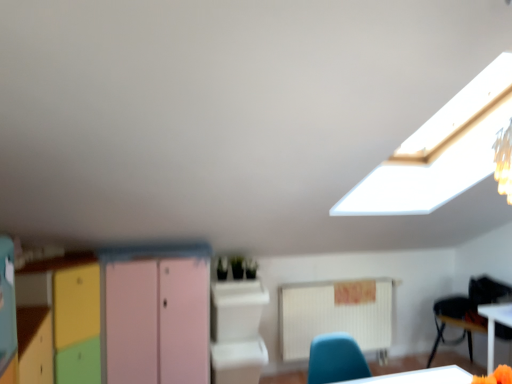
Describe the element at coordinates (237, 331) in the screenshot. I see `white glossy computer desk at center` at that location.

Image resolution: width=512 pixels, height=384 pixels. Describe the element at coordinates (137, 311) in the screenshot. I see `pastel wood cabinet at center` at that location.

Locate an element on the screen. The image size is (512, 384). white plastic chair at lower right is located at coordinates (467, 311).

This screenshot has width=512, height=384. Find the location of `white glossy computer desk at center`. white glossy computer desk at center is located at coordinates (237, 331).

From a real-world perspective, which is physically below, white glossy computer desk at center or white glossy table at lower right?

white glossy table at lower right, from a real-world perspective.

Considering the sizes of objects white glossy computer desk at center and white glossy table at lower right in the image provided, who is shorter, white glossy computer desk at center or white glossy table at lower right?

Standing shorter between the two is white glossy table at lower right.

What's the angular difference between white glossy computer desk at center and white glossy table at lower right's facing directions?

They differ by 89.3 degrees in their facing directions.

From a real-world perspective, is pastel wood cabinet at center over white glossy computer desk at center?

No, from a real-world perspective, pastel wood cabinet at center is not on top of white glossy computer desk at center.

Is pastel wood cabinet at center shorter than white glossy computer desk at center?

No.

Does point (112, 311) lie in front of point (251, 291)?

Yes, it is.

Which object is positioned more to the left, white glossy table at lower right or white glossy computer desk at center?

white glossy computer desk at center.

Considering the relative positions of white glossy table at lower right and white glossy computer desk at center in the image provided, is white glossy table at lower right behind white glossy computer desk at center?

Yes, white glossy table at lower right is further from the viewer.

From a real-world perspective, is white glossy table at lower right above or below white glossy computer desk at center?

Clearly, from a real-world perspective, white glossy table at lower right is below white glossy computer desk at center.

Is pastel wood cabinet at center at the back of white plastic chair at lower right?

white plastic chair at lower right does not have its back to pastel wood cabinet at center.

Between white plastic chair at lower right and pastel wood cabinet at center, which one is positioned behind?

white plastic chair at lower right.

Is white plastic chair at lower right with pastel wood cabinet at center?

There is a gap between white plastic chair at lower right and pastel wood cabinet at center.

Can you confirm if white plastic chair at lower right is smaller than pastel wood cabinet at center?

Yes.

From the image's perspective, does velvet black armchair at lower right appear lower than white plastic chair at lower right?

No, from the image's perspective, velvet black armchair at lower right is not beneath white plastic chair at lower right.

In order to click on armchair that appears above the white plastic chair at lower right (from the image's perspective) in this screenshot , I will do (452, 322).

Is velvet black armchair at lower right far from white plastic chair at lower right?

That's not correct — velvet black armchair at lower right is a little close to white plastic chair at lower right.

Is velvet black armchair at lower right looking in the opposite direction of white plastic chair at lower right?

Yes, velvet black armchair at lower right is positioned with its back facing white plastic chair at lower right.

Is point (498, 320) closer to viewer compared to point (126, 296)?

No, (498, 320) is further to viewer.

Considering the sizes of white glossy table at lower right and pastel wood cabinet at center in the image, is white glossy table at lower right bigger or smaller than pastel wood cabinet at center?

Considering their sizes, white glossy table at lower right takes up less space than pastel wood cabinet at center.

Is white glossy table at lower right oriented towards pastel wood cabinet at center?

Yes.

Does white glossy table at lower right have a greater height compared to pastel wood cabinet at center?

In fact, white glossy table at lower right may be shorter than pastel wood cabinet at center.

Is pink matte/file cabinet at center taller or shorter than pastel wood cabinet at center?

Considering their sizes, pink matte/file cabinet at center has more height than pastel wood cabinet at center.

Who is more distant, pink matte/file cabinet at center or pastel wood cabinet at center?

pink matte/file cabinet at center is further from the camera.

Which is in front, point (149, 260) or point (111, 307)?

The point (111, 307) is in front.

Where is `table top that is behind the white glossy computer desk at center`? table top that is behind the white glossy computer desk at center is located at coordinates (497, 313).

The width and height of the screenshot is (512, 384). I want to click on computer desk positioned vertically above the pastel wood cabinet at center (from a real-world perspective), so click(237, 331).

Which object lies nearer to the anchor point white plastic chair at lower right, white glossy table at lower right or pastel wood cabinet at center?

white glossy table at lower right lies closer to white plastic chair at lower right than the other object.

Considering their positions, is white plastic chair at lower right positioned further to white glossy table at lower right than white glossy computer desk at center?

Based on the image, white glossy computer desk at center appears to be further to white glossy table at lower right.

Estimate the real-world distances between objects in this image. Which object is further from pink matte/file cabinet at center, white glossy computer desk at center or velvet black armchair at lower right?

Based on the image, velvet black armchair at lower right appears to be further to pink matte/file cabinet at center.

Estimate the real-world distances between objects in this image. Which object is closer to white glossy computer desk at center, white plastic chair at lower right or velvet black armchair at lower right?

white plastic chair at lower right.

Estimate the real-world distances between objects in this image. Which object is closer to white glossy computer desk at center, white plastic chair at lower right or pink matte/file cabinet at center?

Based on the image, pink matte/file cabinet at center appears to be nearer to white glossy computer desk at center.

Looking at the image, which one is located further to velvet black armchair at lower right, white glossy table at lower right or pastel wood cabinet at center?

Among the two, pastel wood cabinet at center is located further to velvet black armchair at lower right.

In the scene shown: Estimate the real-world distances between objects in this image. Which object is closer to white glossy computer desk at center, pastel wood cabinet at center or pink matte/file cabinet at center?

pink matte/file cabinet at center.

Considering their positions, is velvet black armchair at lower right positioned closer to pink matte/file cabinet at center than white glossy table at lower right?

The object closer to pink matte/file cabinet at center is white glossy table at lower right.

Identify the location of computer desk situated between pastel wood cabinet at center and white glossy table at lower right from left to right. (237, 331).

I want to click on computer desk between pastel wood cabinet at center and white plastic chair at lower right from left to right, so click(x=237, y=331).

This screenshot has height=384, width=512. What are the coordinates of `armchair between pink matte/file cabinet at center and white plastic chair at lower right` in the screenshot? It's located at (452, 322).

This screenshot has width=512, height=384. What are the coordinates of `computer desk between pink matte/file cabinet at center and velvet black armchair at lower right in the horizontal direction` in the screenshot? It's located at (237, 331).